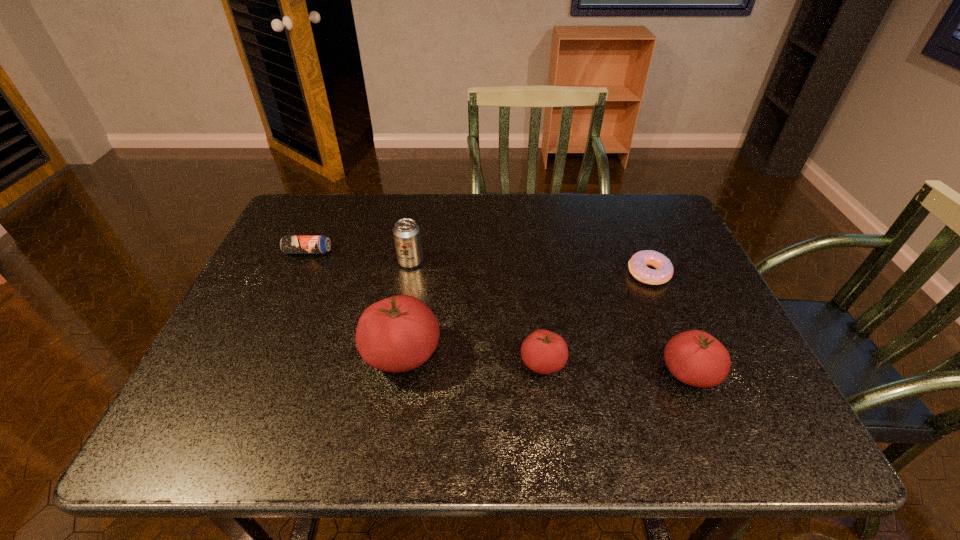
Locate an element on the screen. the tallest tomato is located at coordinates (398, 334).

You are a GUI agent. You are given a task and a screenshot of the screen. Output one action in this format:
    pyautogui.click(x=<x>, y=<y>)
    Task: Click on the leftmost tomato
    
    Given the screenshot: What is the action you would take?
    pyautogui.click(x=398, y=334)

You are a GUI agent. You are given a task and a screenshot of the screen. Output one action in this format:
    pyautogui.click(x=<x>, y=<y>)
    Task: Click on the second tomato from right to left
    The image size is (960, 540).
    Given the screenshot: What is the action you would take?
    pyautogui.click(x=544, y=352)

The width and height of the screenshot is (960, 540). In order to click on the third object from right to left in this screenshot , I will do `click(544, 352)`.

Find the location of `the second tallest tomato`. the second tallest tomato is located at coordinates (696, 358).

The height and width of the screenshot is (540, 960). I want to click on doughnut, so click(x=638, y=265).

Locate an element on the screen. Image resolution: width=960 pixels, height=540 pixels. the shorter beer can is located at coordinates (289, 244).

You are a GUI agent. You are given a task and a screenshot of the screen. Output one action in this format:
    pyautogui.click(x=<x>, y=<y>)
    Task: Click on the left beer can
    
    Given the screenshot: What is the action you would take?
    pyautogui.click(x=289, y=244)

You are a GUI agent. You are given a task and a screenshot of the screen. Output one action in this format:
    pyautogui.click(x=<x>, y=<y>)
    Task: Click on the right beer can
    This screenshot has height=540, width=960.
    Given the screenshot: What is the action you would take?
    pyautogui.click(x=406, y=232)

This screenshot has height=540, width=960. In order to click on free space located on the left of the leftmost tomato in this screenshot , I will do `click(272, 354)`.